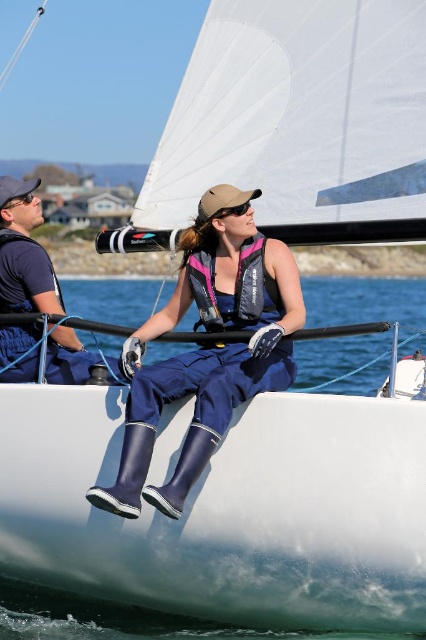
Question: Does navy rubber boots at center appear under matte black camera at left?

Choices:
 (A) yes
 (B) no

Answer: (A)

Question: Among these objects, which one is nearest to the camera?

Choices:
 (A) navy rubber boots at center
 (B) matte black camera at left

Answer: (B)

Question: Is navy rubber boots at center wider than matte black camera at left?

Choices:
 (A) yes
 (B) no

Answer: (B)

Question: Which point is farther from the camera taking this photo?

Choices:
 (A) (2, 236)
 (B) (207, 230)

Answer: (A)

Question: Is navy rubber boots at center bigger than matte black camera at left?

Choices:
 (A) yes
 (B) no

Answer: (B)

Question: Among these objects, which one is farthest from the camera?

Choices:
 (A) navy rubber boots at center
 (B) matte black camera at left

Answer: (A)